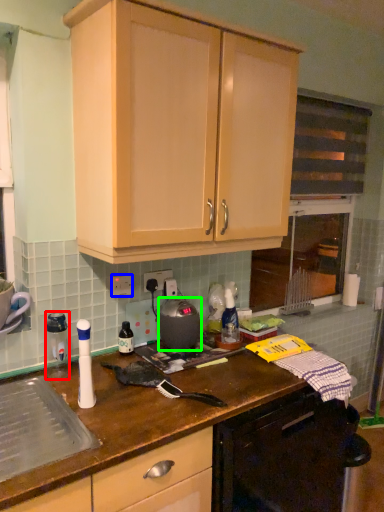
Question: Which is farther away from appliance (highlighted by a red box)? electric outlet (highlighted by a blue box) or kitchen appliance (highlighted by a green box)?

Choices:
 (A) electric outlet
 (B) kitchen appliance

Answer: (B)